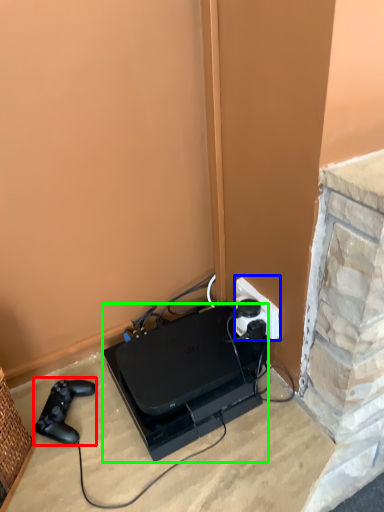
Question: Which object is positioned farthest from game controller (highlighted by a red box)? Select from power plugs and sockets (highlighted by a blue box) and appliance (highlighted by a green box).

Choices:
 (A) power plugs and sockets
 (B) appliance

Answer: (A)